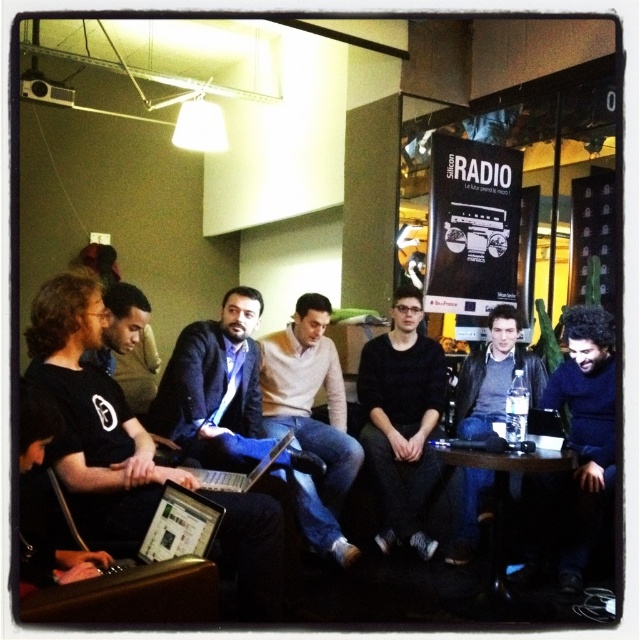
You are organizing a small event and need to place a decorative item on the table. Given the light brown sweater at center and the black plastic table at lower center, which object is narrower and thus suitable for placement on the table without overcrowding?

The light brown sweater at center has a lesser width compared to the black plastic table at lower center, so it is narrower and suitable for placement on the table without overcrowding.